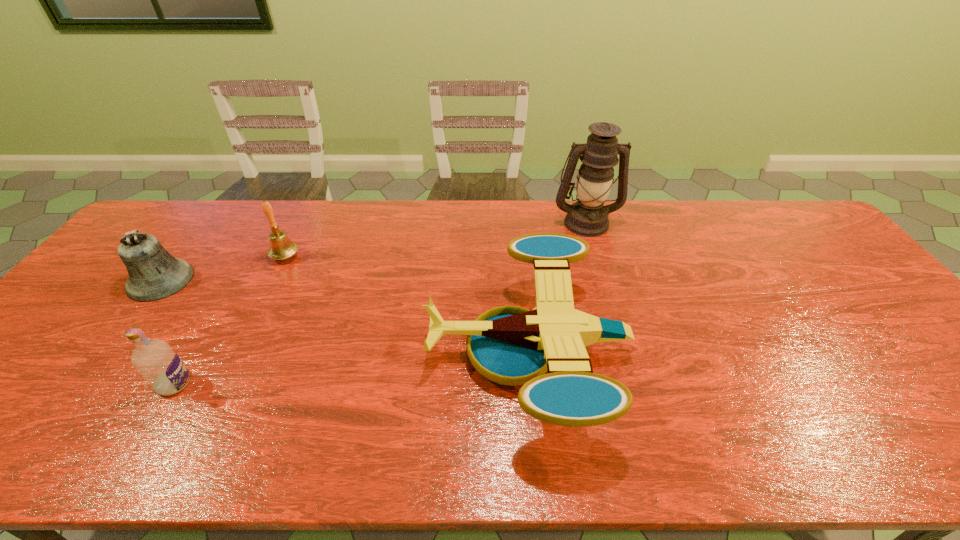
Locate an element on the screen. object that is the closest one to the drone is located at coordinates (587, 217).

Identify the location of object that is the fourth closest to the third object from left to right. This screenshot has height=540, width=960. (587, 217).